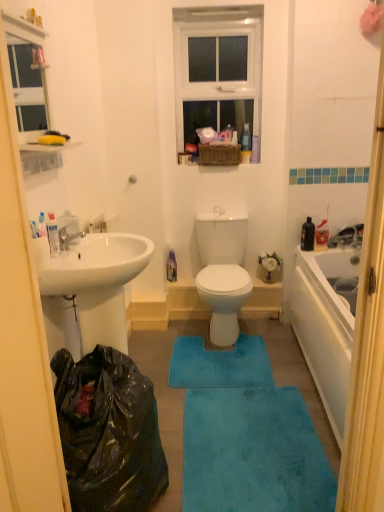
The image size is (384, 512). I want to click on vacant area located to the right-hand side of white plastic toothpaste tube at left, so click(x=68, y=255).